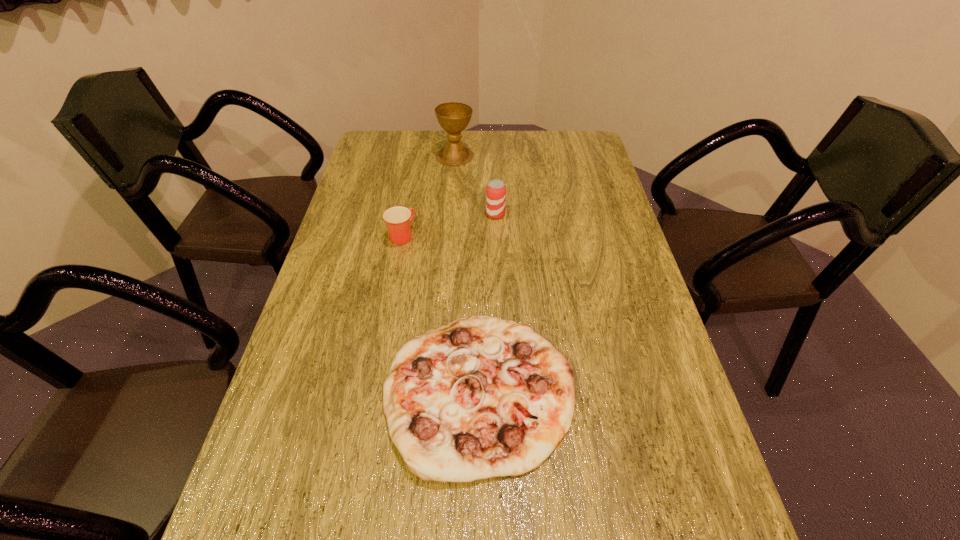
You are a GUI agent. You are given a task and a screenshot of the screen. Output one action in this format:
    pyautogui.click(x=<x>, y=<y>)
    Task: Click on the vacant space that's between the third farthest object and the shortest object
    
    Given the screenshot: What is the action you would take?
    pyautogui.click(x=440, y=313)

Identify the location of free space between the pizza and the chalice. (467, 273).

I want to click on blank region between the pizza and the third farthest object, so click(440, 313).

Identify the location of vacant space that's between the beer can and the nearest object. (487, 302).

Locate an element on the screen. The height and width of the screenshot is (540, 960). vacant area between the third tallest object and the third shortest object is located at coordinates (448, 225).

Image resolution: width=960 pixels, height=540 pixels. I want to click on vacant area between the chalice and the nearest object, so 467,273.

The width and height of the screenshot is (960, 540). I want to click on free space between the tallest object and the third nearest object, so click(x=475, y=185).

At what (x,y) coordinates should I click in order to perform the action: click on free space between the pizza and the second shortest object. Please return your answer as a coordinate pair (x, y). The image size is (960, 540). Looking at the image, I should click on (440, 313).

I want to click on vacant area that lies between the shortest object and the beer can, so click(487, 302).

Locate an element on the screen. The height and width of the screenshot is (540, 960). object that stands as the closest to the farthest object is located at coordinates (495, 191).